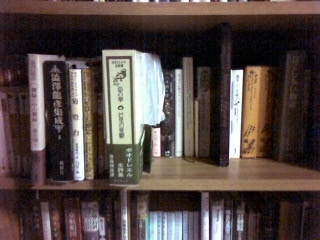
Identify the location of dark brown books at top of bookcase on the left. (165, 9), (164, 22), (151, 71).